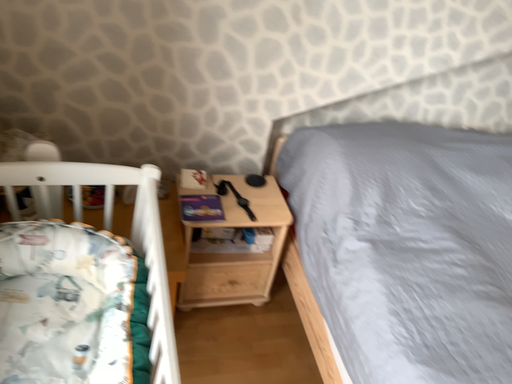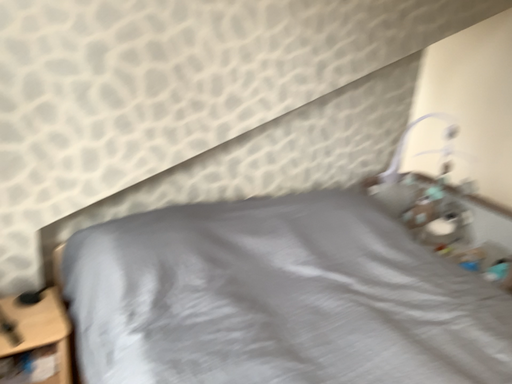
Question: Which way did the camera rotate in the video?

Choices:
 (A) rotated downward
 (B) rotated upward

Answer: (B)